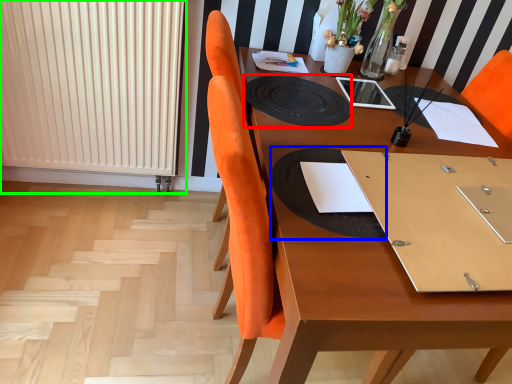
Question: Which is nearer to the mat (highlighted by a red box)? place mat (highlighted by a blue box) or radiator (highlighted by a green box).

Choices:
 (A) place mat
 (B) radiator

Answer: (A)